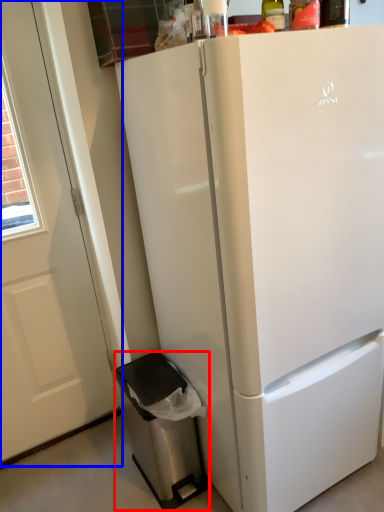
Question: Which object appears farthest to the camera in this image, dish washer (highlighted by a red box) or screen door (highlighted by a blue box)?

Choices:
 (A) dish washer
 (B) screen door

Answer: (A)